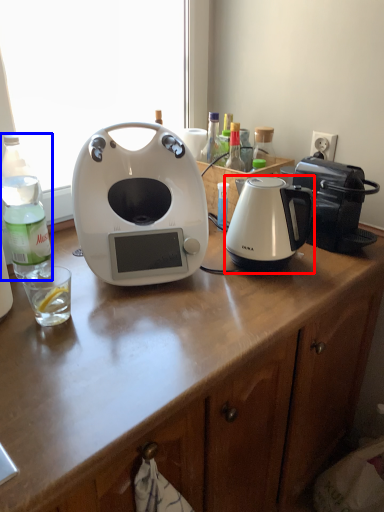
Question: Which point is further to the camera, kettle (highlighted by a red box) or bottle (highlighted by a blue box)?

Choices:
 (A) kettle
 (B) bottle

Answer: (A)